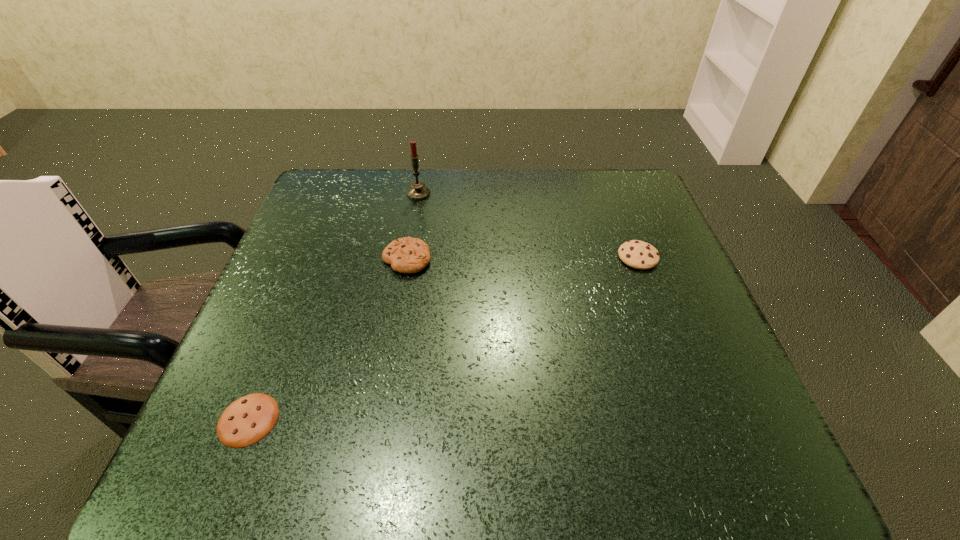
The image size is (960, 540). In order to click on vacant space at the near left corner of the desktop in this screenshot , I will do `click(269, 434)`.

The image size is (960, 540). I want to click on blank space at the near right corner of the desktop, so click(x=730, y=467).

Where is `vacant area that lies between the nearest cookie and the farthest object`? This screenshot has height=540, width=960. vacant area that lies between the nearest cookie and the farthest object is located at coordinates (333, 307).

This screenshot has width=960, height=540. I want to click on free space between the rightmost object and the tallest object, so click(528, 226).

Where is `vacant area between the rightmost cookie and the tallest object`? Image resolution: width=960 pixels, height=540 pixels. vacant area between the rightmost cookie and the tallest object is located at coordinates (528, 226).

Find the location of `free point between the shortest object and the candle`. free point between the shortest object and the candle is located at coordinates (333, 307).

Where is `vacant space that's between the rightmost cookie and the farthest object`? vacant space that's between the rightmost cookie and the farthest object is located at coordinates (x=528, y=226).

I want to click on empty space that is in between the second cookie from right to left and the candle, so click(x=413, y=226).

Locate an element on the screen. Image resolution: width=960 pixels, height=540 pixels. free area in between the second cookie from right to left and the rightmost object is located at coordinates (522, 258).

The width and height of the screenshot is (960, 540). I want to click on vacant area that lies between the leftmost object and the rightmost object, so click(444, 338).